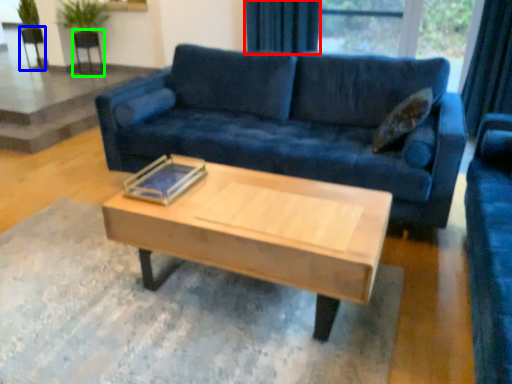
Question: Which is farther away from curtain (highlighted by a red box)? armchair (highlighted by a blue box) or armchair (highlighted by a green box)?

Choices:
 (A) armchair
 (B) armchair

Answer: (A)